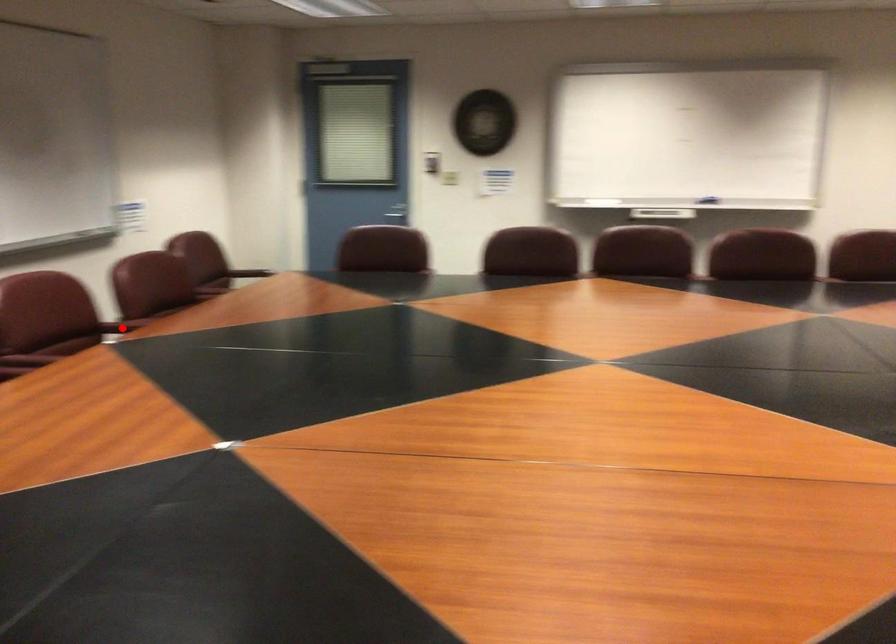
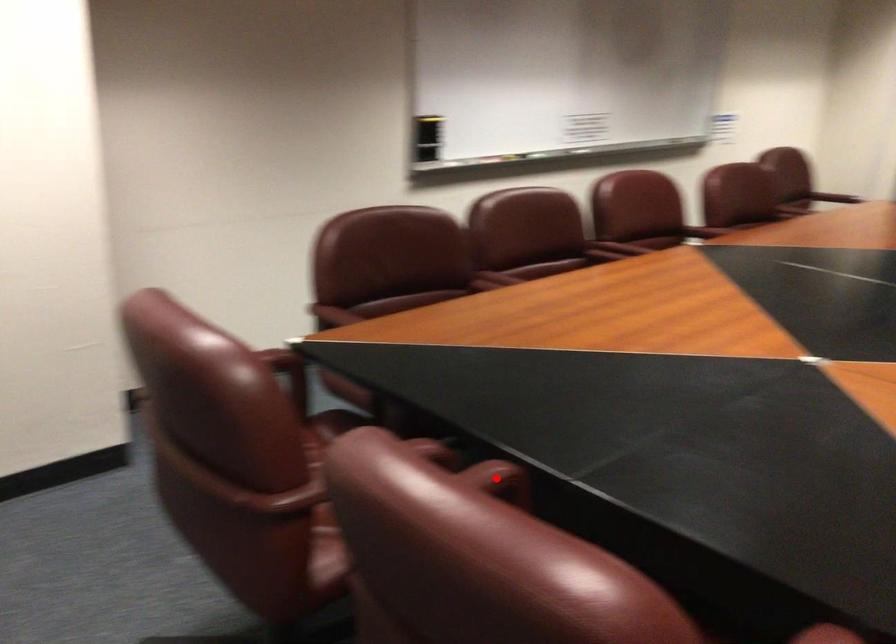
I am providing you with two images of the same scene from different viewpoints. A red point is marked on the first image and another point is marked on the second image. Is the red point in image1 aligned with the point shown in image2?

No